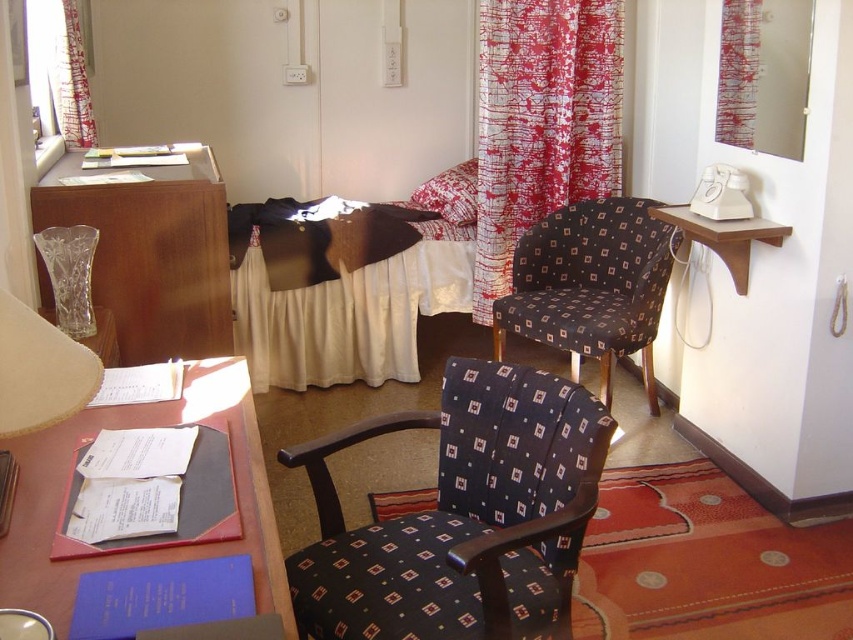
Is point (123, 204) behind point (73, 384)?

Yes, it is.

Which is in front, point (126, 300) or point (54, 419)?

Point (54, 419)

Find the location of a particular element. transparent glass vase at left is located at coordinates (154, 253).

Is matte glass lampshade at left shorter than red printed fabric curtain at upper right?

Yes.

Where is `matte glass lampshade at left`? This screenshot has width=853, height=640. matte glass lampshade at left is located at coordinates click(x=39, y=371).

Between red printed fabric curtain at upper center and dark blue fabric swivel chair at center, which one is positioned lower?

dark blue fabric swivel chair at center is below.

Is point (523, 225) less distant than point (648, 285)?

That is False.

You are a GUI agent. You are given a task and a screenshot of the screen. Output one action in this format:
    pyautogui.click(x=<x>, y=<y>)
    Task: Click on the red printed fabric curtain at upper center
    
    Given the screenshot: What is the action you would take?
    pyautogui.click(x=541, y=122)